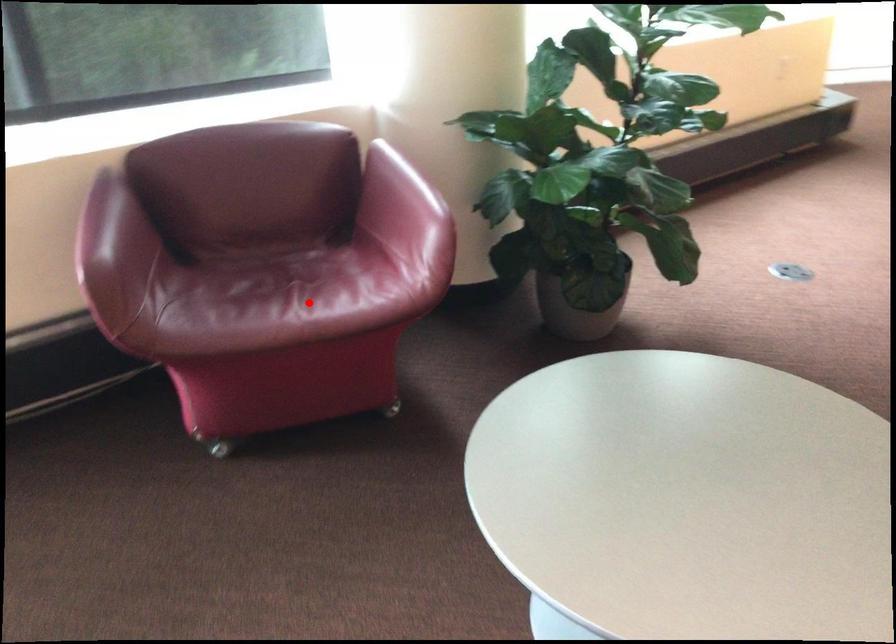
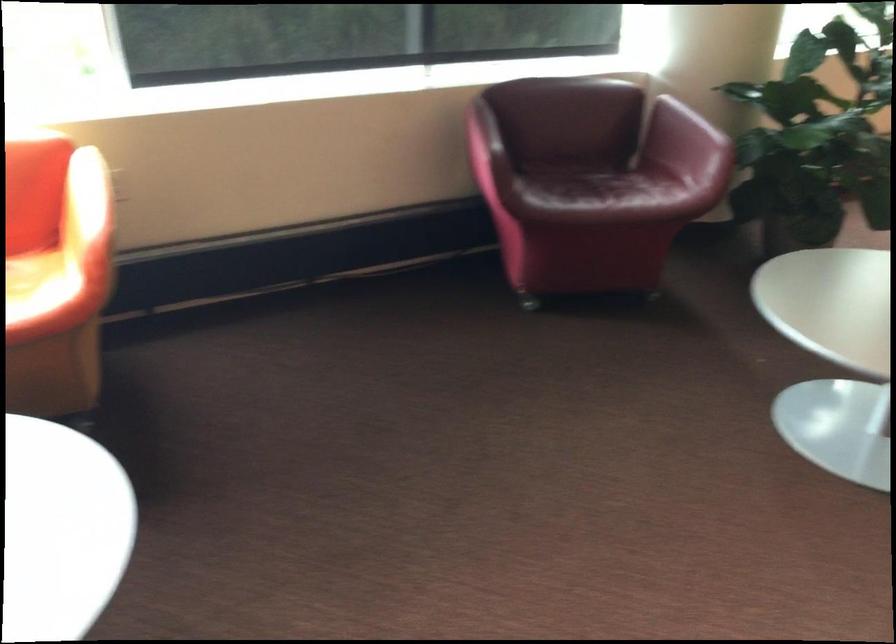
Question: I am providing you with two images of the same scene from different viewpoints. Image1 has a red point marked. In image2, the corresponding 3D location appears at what relative position? Reply with the corresponding letter.

Choices:
 (A) Closer
 (B) Farther

Answer: (B)